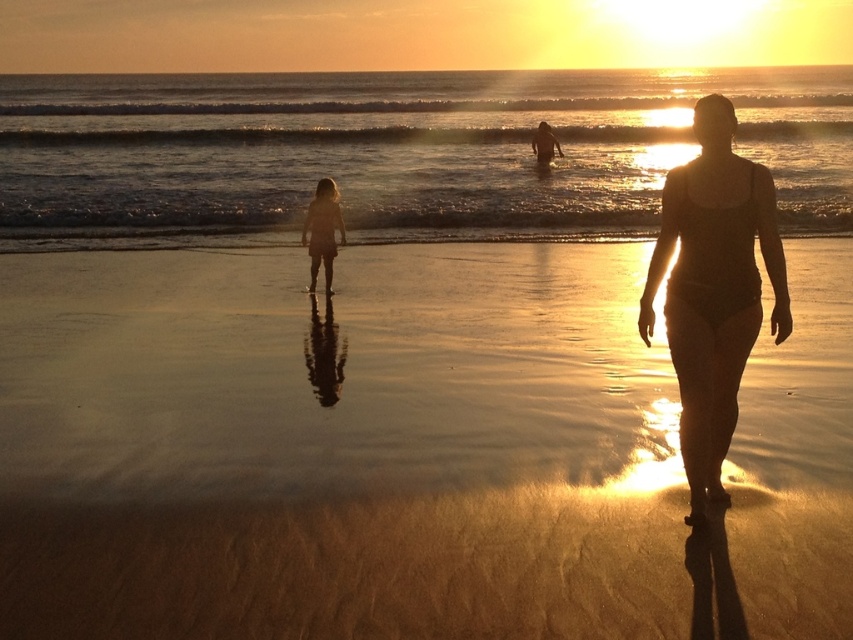
You are standing on the sandy beach at center and want to give a towel to the person wearing the satin black swimsuit at right. If you can throw the towel 7 feet, will you be able to reach them?

The distance between the sandy beach at center and the satin black swimsuit at right is 6.81 feet. Since you can throw the towel 7 feet, you will be able to reach them as 6.81 is less than 7.